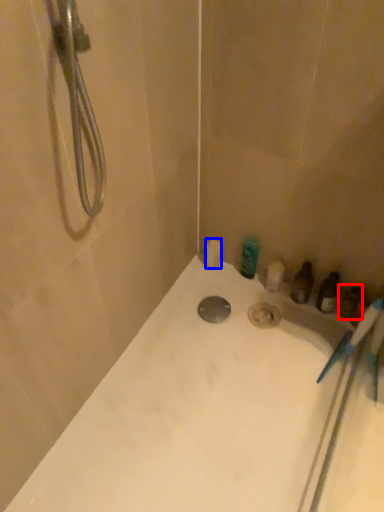
Question: Among these objects, which one is nearest to the camera, toiletry (highlighted by a red box) or toilet paper (highlighted by a blue box)?

Choices:
 (A) toiletry
 (B) toilet paper

Answer: (A)